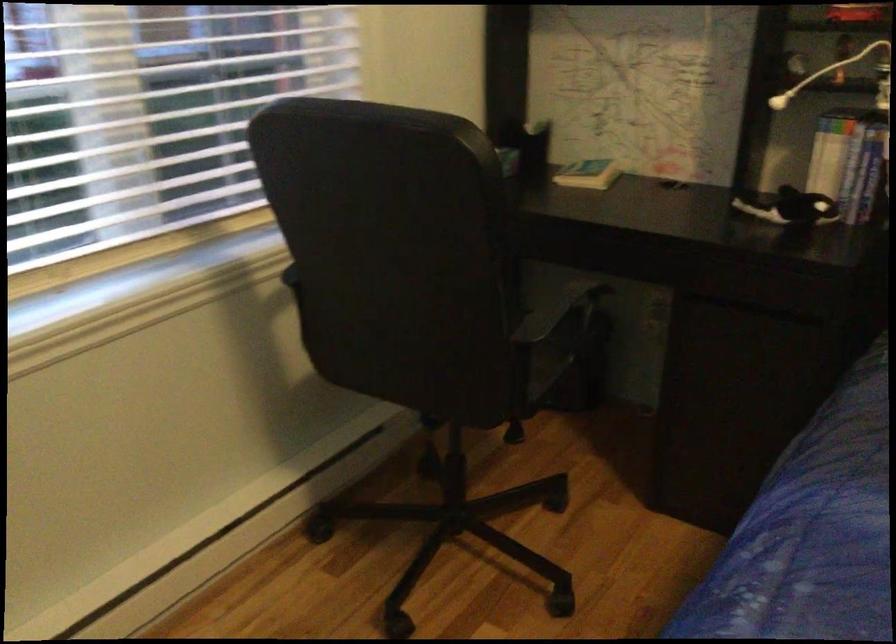
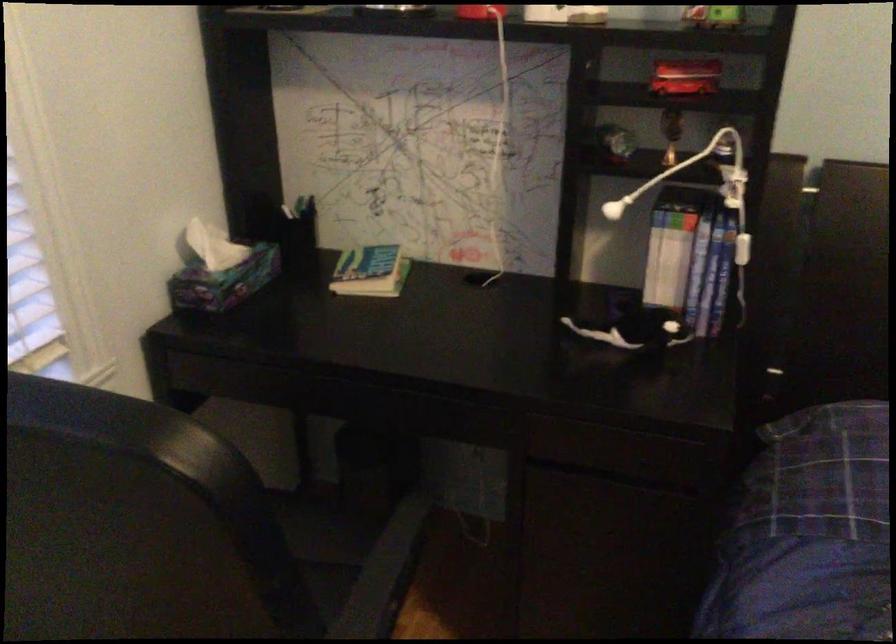
In the second image, find the point that corresponds to point 532,128 in the first image.

(295, 211)